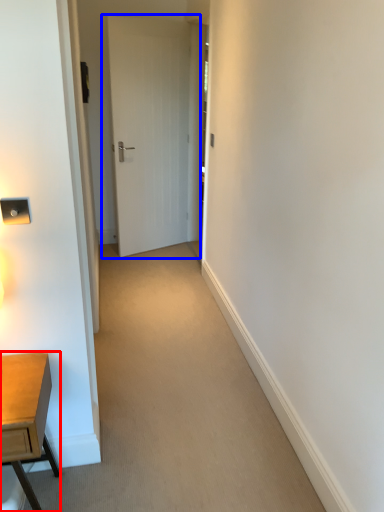
Question: Which object is further to the camera taking this photo, desk (highlighted by a red box) or door (highlighted by a blue box)?

Choices:
 (A) desk
 (B) door

Answer: (B)